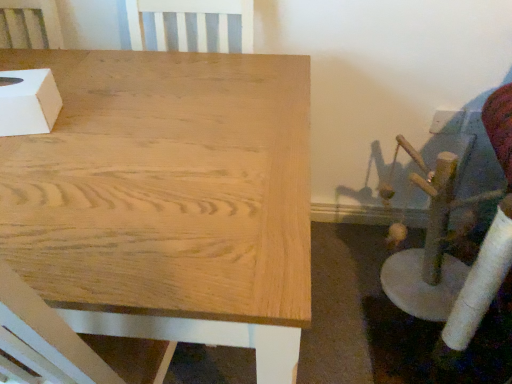
Question: From the image's perspective, is natural wood table at center on white matte tissue box at upper left?

Choices:
 (A) no
 (B) yes

Answer: (A)

Question: Can you confirm if natural wood table at center is positioned to the right of white matte tissue box at upper left?

Choices:
 (A) yes
 (B) no

Answer: (A)

Question: Can you confirm if natural wood table at center is thinner than white matte tissue box at upper left?

Choices:
 (A) yes
 (B) no

Answer: (B)

Question: From the image's perspective, is natural wood table at center below white matte tissue box at upper left?

Choices:
 (A) yes
 (B) no

Answer: (A)

Question: Can you confirm if natural wood table at center is bigger than white matte tissue box at upper left?

Choices:
 (A) yes
 (B) no

Answer: (A)

Question: Is natural wood table at center looking in the opposite direction of white matte tissue box at upper left?

Choices:
 (A) no
 (B) yes

Answer: (A)

Question: Is white matte tissue box at upper left turned away from natural wood table at center?

Choices:
 (A) yes
 (B) no

Answer: (B)

Question: Is white matte tissue box at upper left beside natural wood table at center?

Choices:
 (A) yes
 (B) no

Answer: (B)

Question: Considering the relative sizes of white matte tissue box at upper left and natural wood table at center in the image provided, is white matte tissue box at upper left shorter than natural wood table at center?

Choices:
 (A) yes
 (B) no

Answer: (A)

Question: Can you confirm if white matte tissue box at upper left is smaller than natural wood table at center?

Choices:
 (A) no
 (B) yes

Answer: (B)

Question: Is white matte tissue box at upper left located outside natural wood table at center?

Choices:
 (A) yes
 (B) no

Answer: (A)

Question: Does white matte tissue box at upper left have a larger size compared to natural wood table at center?

Choices:
 (A) no
 (B) yes

Answer: (A)

Question: Looking at their shapes, would you say white matte tissue box at upper left is wider or thinner than natural wood table at center?

Choices:
 (A) wide
 (B) thin

Answer: (B)